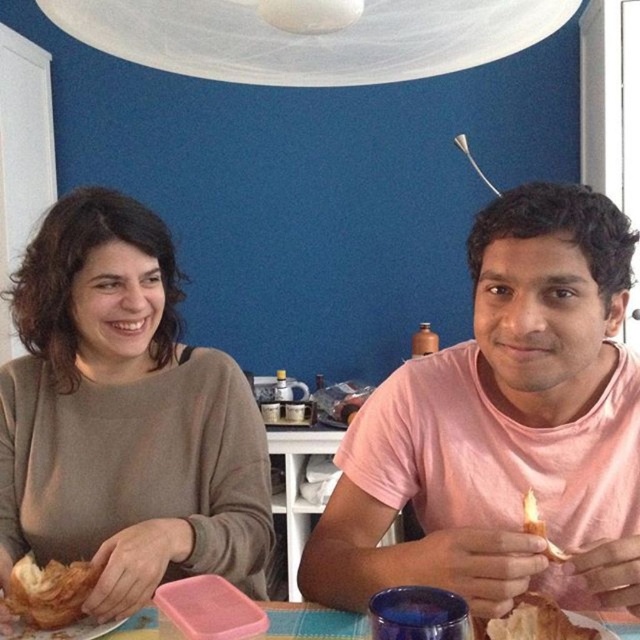
Is blue woven table at lower center in front of golden crispy bread at right?

No, it is not.

Can you confirm if blue woven table at lower center is wider than golden crispy bread at right?

Yes, blue woven table at lower center is wider than golden crispy bread at right.

You are a GUI agent. You are given a task and a screenshot of the screen. Output one action in this format:
    pyautogui.click(x=<x>, y=<y>)
    Task: Click on the blue woven table at lower center
    Image resolution: width=640 pixels, height=640 pixels.
    Given the screenshot: What is the action you would take?
    pyautogui.click(x=310, y=621)

Does pink matte shirt at right have a greater width compared to matte brown sweater at left?

No.

Does pink matte shirt at right appear on the left side of matte brown sweater at left?

In fact, pink matte shirt at right is to the right of matte brown sweater at left.

You are a GUI agent. You are given a task and a screenshot of the screen. Output one action in this format:
    pyautogui.click(x=<x>, y=<y>)
    Task: Click on the pink matte shirt at right
    This screenshot has width=640, height=640.
    Given the screenshot: What is the action you would take?
    pyautogui.click(x=502, y=428)

At what (x,y) coordinates should I click in order to perform the action: click on pink matte shirt at right. Please return your answer as a coordinate pair (x, y). Looking at the image, I should click on (502, 428).

Can you confirm if pink matte shirt at right is smaller than golden crispy croissant at lower left?

Incorrect, pink matte shirt at right is not smaller in size than golden crispy croissant at lower left.

Which is above, pink matte shirt at right or golden crispy croissant at lower left?

pink matte shirt at right is above.

Between point (576, 458) and point (28, 609), which one is positioned behind?

Positioned behind is point (576, 458).

Identify the location of pink matte shirt at right. The height and width of the screenshot is (640, 640). (502, 428).